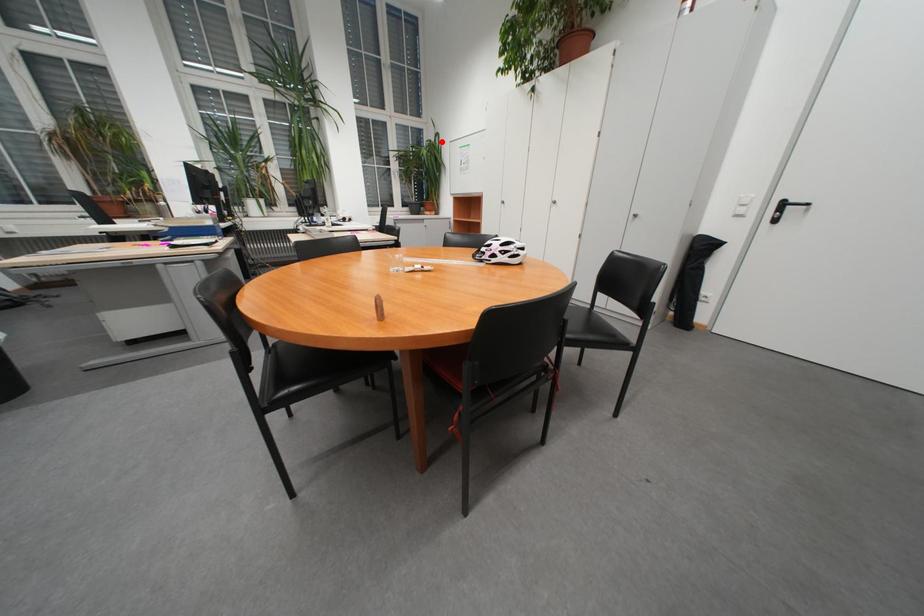
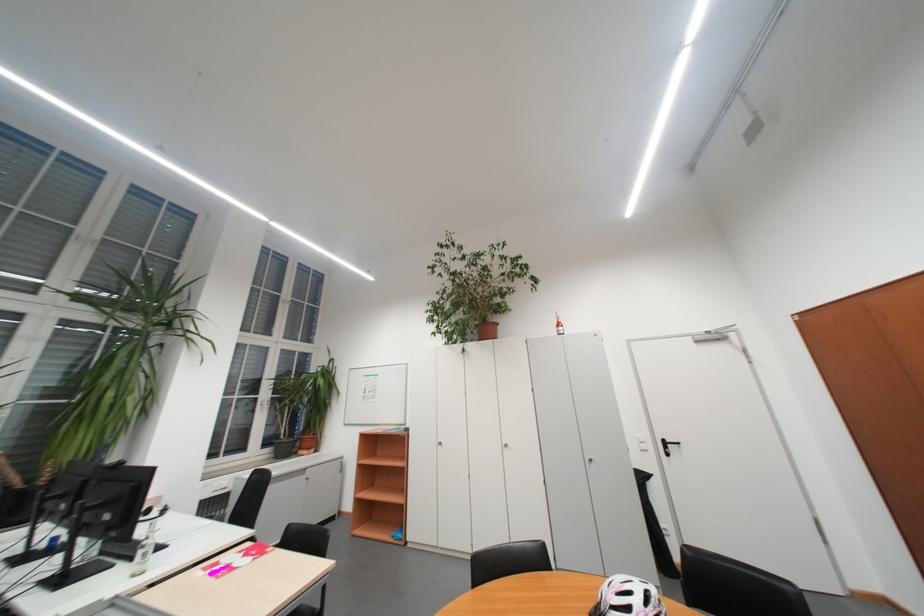
Question: A red point is marked in image1. In image2, is the corresponding 3D point closer to the camera or farther? Reply with the corresponding letter.

Choices:
 (A) The corresponding 3D point is closer.
 (B) The corresponding 3D point is farther.

Answer: (B)